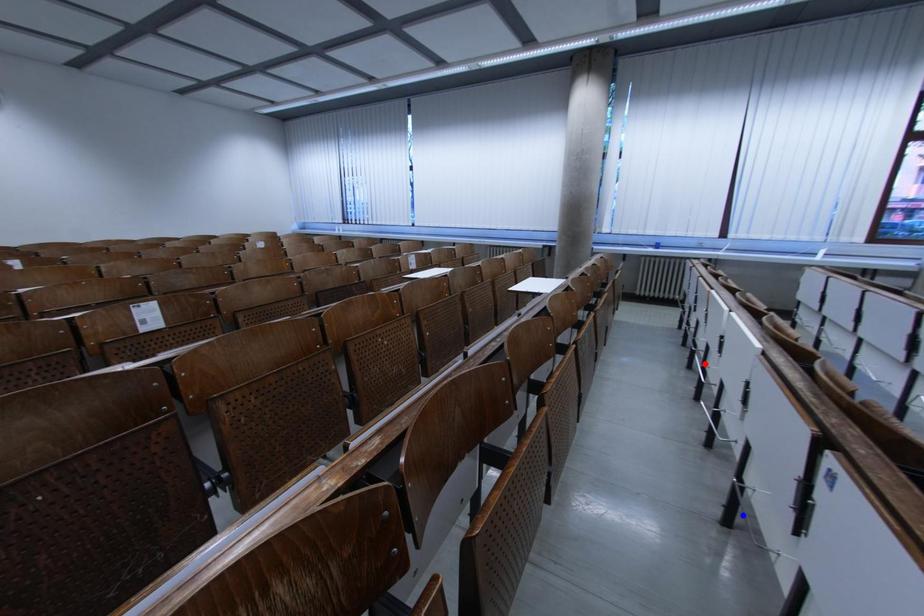
Question: In the image, two points are highlighted. Which point is nearer to the camera? Reply with the corresponding letter.

Choices:
 (A) blue point
 (B) red point

Answer: (A)